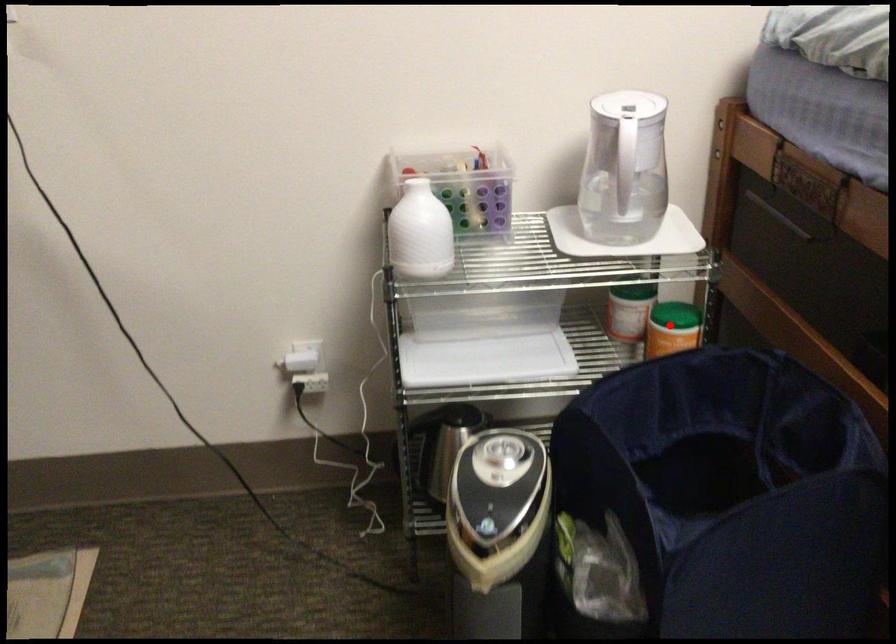
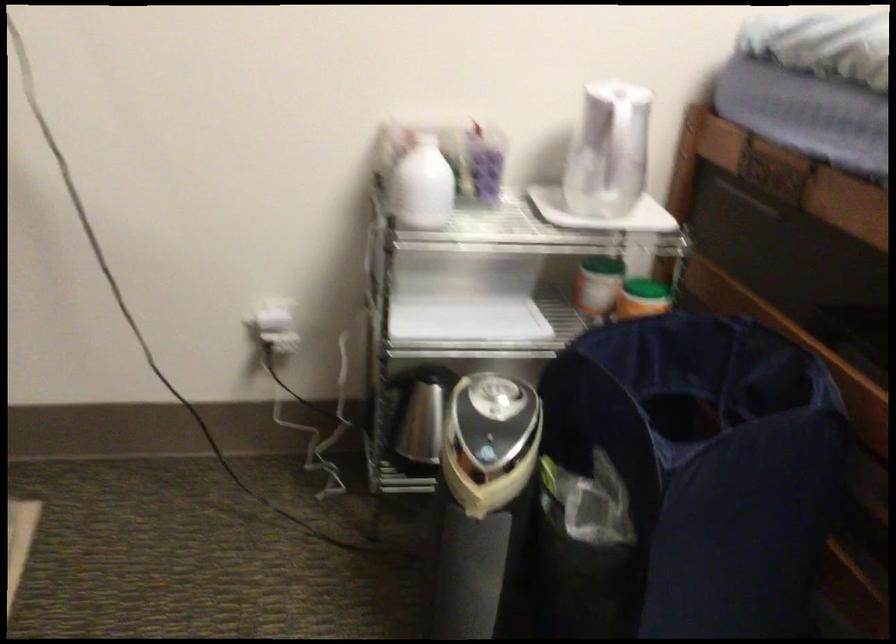
Where in the second image is the point corresponding to the highlighted location from the first image?

(642, 298)